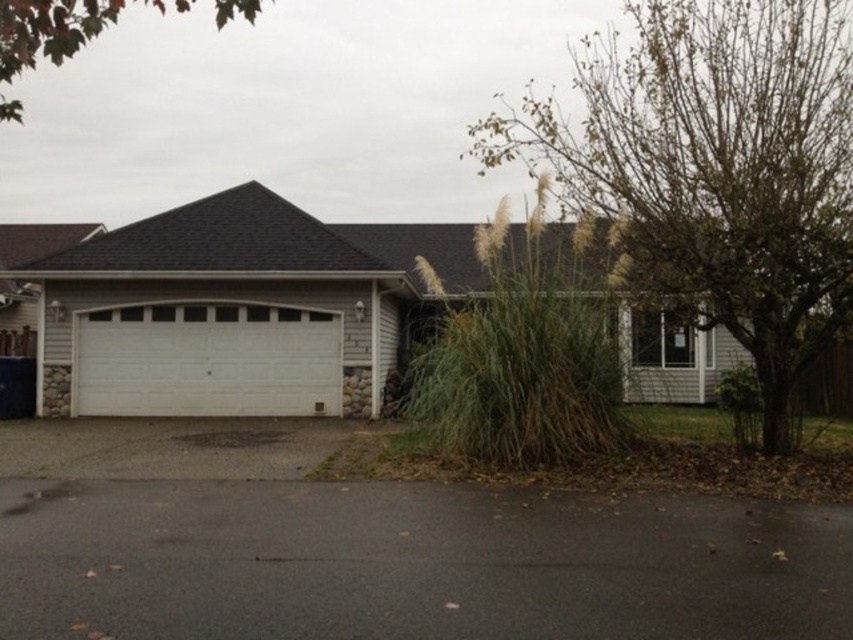
Question: Which of the following is the closest to the observer?

Choices:
 (A) (825, 618)
 (B) (117, 3)

Answer: (A)

Question: From the image, what is the correct spatial relationship of white painted wood garage at center in relation to white painted wood garage door at center?

Choices:
 (A) below
 (B) above

Answer: (B)

Question: Considering the real-world distances, which object is closest to the black asphalt driveway at lower center?

Choices:
 (A) white painted wood garage door at center
 (B) white painted wood garage at center
 (C) green grass at lower right
 (D) green leafy tree at upper left

Answer: (A)

Question: Based on their relative distances, which object is farther from the green leafy tree at upper left?

Choices:
 (A) white painted wood garage door at center
 (B) green grass at lower right
 (C) black asphalt driveway at lower center

Answer: (C)

Question: Does white painted wood garage at center have a lesser width compared to green leafy tree at upper left?

Choices:
 (A) yes
 (B) no

Answer: (A)

Question: Is green grass at lower right to the left of white painted wood garage at center from the viewer's perspective?

Choices:
 (A) yes
 (B) no

Answer: (B)